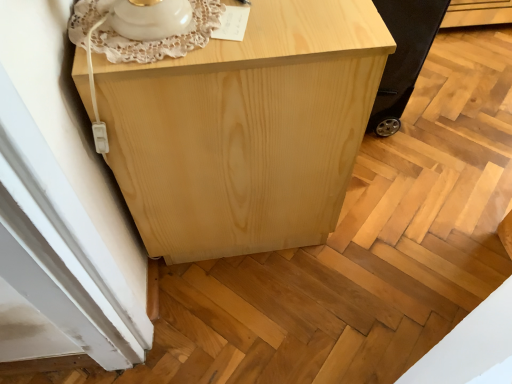
This screenshot has height=384, width=512. Identify the location of natural wood cabinet at center. (246, 130).

Describe the element at coordinates (246, 130) in the screenshot. The image size is (512, 384). I see `natural wood cabinet at center` at that location.

You are a GUI agent. You are given a task and a screenshot of the screen. Output one action in this format:
    pyautogui.click(x=<x>, y=<y>)
    Task: Click on the black rubber wheel at lower right
    The width and height of the screenshot is (512, 384).
    Given the screenshot: What is the action you would take?
    pyautogui.click(x=403, y=56)

The height and width of the screenshot is (384, 512). What do you see at coordinates (403, 56) in the screenshot? I see `black rubber wheel at lower right` at bounding box center [403, 56].

Where is `natural wood cabinet at center`? This screenshot has width=512, height=384. natural wood cabinet at center is located at coordinates (246, 130).

Which object is positioned more to the right, natural wood cabinet at center or black rubber wheel at lower right?

From the viewer's perspective, black rubber wheel at lower right appears more on the right side.

In the scene shown: Is natural wood cabinet at center closer to camera compared to black rubber wheel at lower right?

Yes, natural wood cabinet at center is closer to the viewer.

Is point (129, 176) positioned before point (388, 78)?

That is True.

In the scene shown: From the image's perspective, who appears lower, natural wood cabinet at center or black rubber wheel at lower right?

natural wood cabinet at center appears lower in the image.

From a real-world perspective, is natural wood cabinet at center physically located above or below black rubber wheel at lower right?

From a real-world perspective, natural wood cabinet at center is physically above black rubber wheel at lower right.

Between natural wood cabinet at center and black rubber wheel at lower right, which one has smaller width?

Thinner between the two is black rubber wheel at lower right.

In terms of height, does natural wood cabinet at center look taller or shorter compared to black rubber wheel at lower right?

Considering their sizes, natural wood cabinet at center has more height than black rubber wheel at lower right.

Considering the sizes of natural wood cabinet at center and black rubber wheel at lower right in the image, is natural wood cabinet at center bigger or smaller than black rubber wheel at lower right?

natural wood cabinet at center is bigger than black rubber wheel at lower right.

Is natural wood cabinet at center surrounding black rubber wheel at lower right?

No, black rubber wheel at lower right is not a part of natural wood cabinet at center.

Is natural wood cabinet at center in contact with black rubber wheel at lower right?

There is a gap between natural wood cabinet at center and black rubber wheel at lower right.

Could you tell me if natural wood cabinet at center is turned towards black rubber wheel at lower right?

Yes.

What's the angular difference between natural wood cabinet at center and black rubber wheel at lower right's facing directions?

2.71 degrees separate the facing orientations of natural wood cabinet at center and black rubber wheel at lower right.

I want to click on baby carriage directly beneath the natural wood cabinet at center (from a real-world perspective), so click(x=403, y=56).

Between black rubber wheel at lower right and natural wood cabinet at center, which one appears on the left side from the viewer's perspective?

Positioned to the left is natural wood cabinet at center.

Does black rubber wheel at lower right lie behind natural wood cabinet at center?

Yes, black rubber wheel at lower right is further from the camera.

Which is behind, point (382, 134) or point (115, 123)?

Positioned behind is point (382, 134).

From the image's perspective, would you say black rubber wheel at lower right is shown under natural wood cabinet at center?

No, from the image's perspective, black rubber wheel at lower right is not beneath natural wood cabinet at center.

From a real-world perspective, is black rubber wheel at lower right on top of natural wood cabinet at center?

Incorrect, from a real-world perspective, black rubber wheel at lower right is lower than natural wood cabinet at center.

Between black rubber wheel at lower right and natural wood cabinet at center, which one has smaller width?

With smaller width is black rubber wheel at lower right.

Who is shorter, black rubber wheel at lower right or natural wood cabinet at center?

Standing shorter between the two is black rubber wheel at lower right.

Does black rubber wheel at lower right have a smaller size compared to natural wood cabinet at center?

Yes.

Is black rubber wheel at lower right positioned beyond the bounds of natural wood cabinet at center?

Yes, black rubber wheel at lower right is outside of natural wood cabinet at center.

Is black rubber wheel at lower right directly adjacent to natural wood cabinet at center?

They are not placed beside each other.

Is black rubber wheel at lower right turned away from natural wood cabinet at center?

Absolutely, black rubber wheel at lower right is directed away from natural wood cabinet at center.

Where is `furniture that is on the left side of black rubber wheel at lower right`? This screenshot has height=384, width=512. furniture that is on the left side of black rubber wheel at lower right is located at coordinates (246, 130).

Find the location of a particular element. This screenshot has width=512, height=384. baby carriage located above the natural wood cabinet at center (from the image's perspective) is located at coordinates (403, 56).

This screenshot has height=384, width=512. In order to click on baby carriage on the right side of natural wood cabinet at center in this screenshot , I will do `click(403, 56)`.